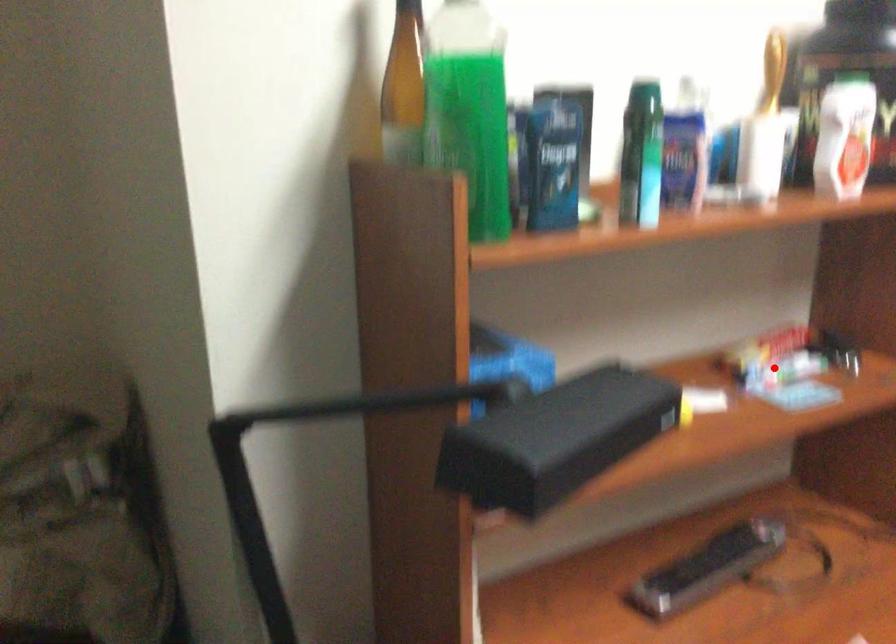
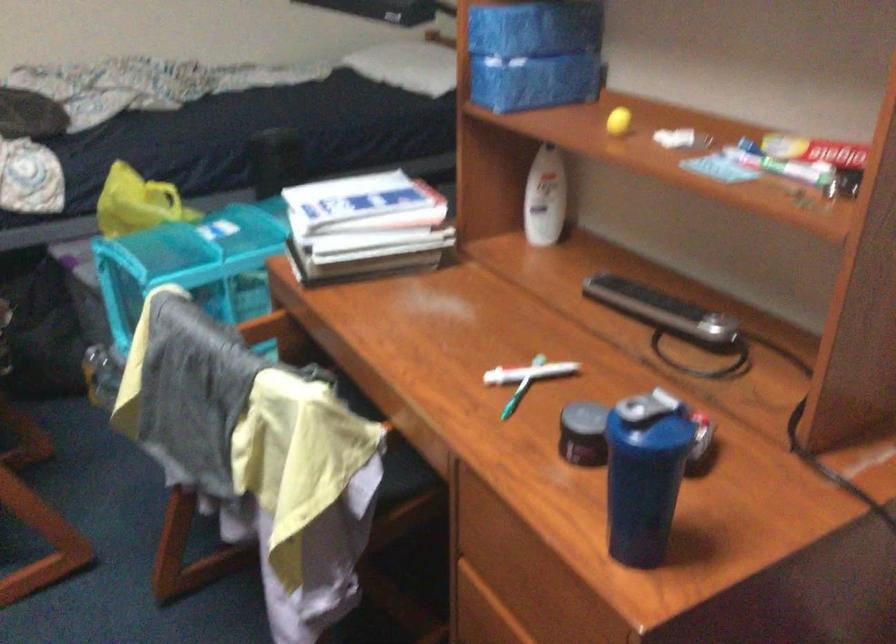
Question: A red point is marked in image1. In image2, is the corresponding 3D point closer to the camera or farther? Reply with the corresponding letter.

Choices:
 (A) The corresponding 3D point is closer.
 (B) The corresponding 3D point is farther.

Answer: (A)